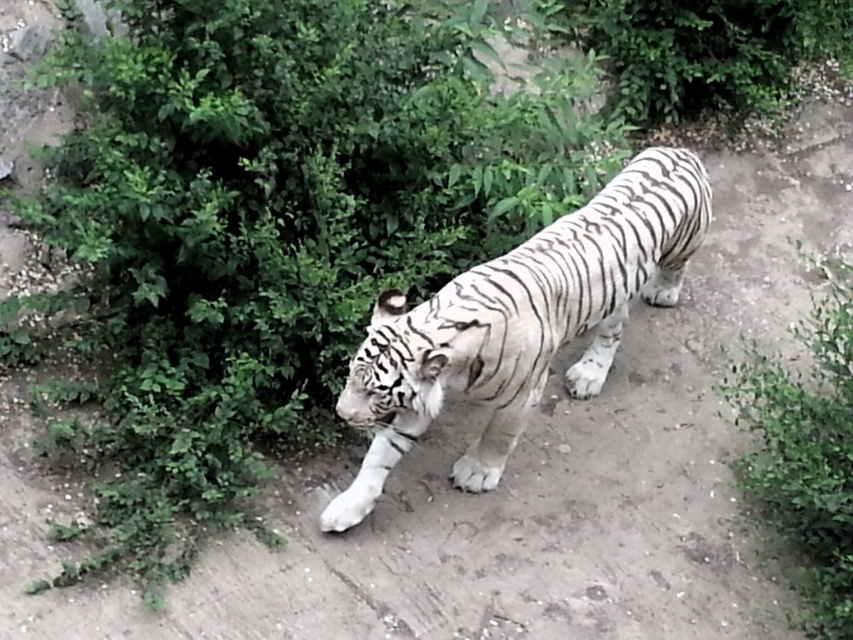
Does white striped tiger at center have a greater width compared to green leafy bush at lower right?

Yes, white striped tiger at center is wider than green leafy bush at lower right.

Is white striped tiger at center to the right of green leafy bush at lower right from the viewer's perspective?

No, white striped tiger at center is not to the right of green leafy bush at lower right.

Is point (482, 324) in front of point (833, 483)?

No.

You are a GUI agent. You are given a task and a screenshot of the screen. Output one action in this format:
    pyautogui.click(x=<x>, y=<y>)
    Task: Click on the white striped tiger at center
    This screenshot has height=640, width=853.
    Given the screenshot: What is the action you would take?
    pyautogui.click(x=520, y=323)